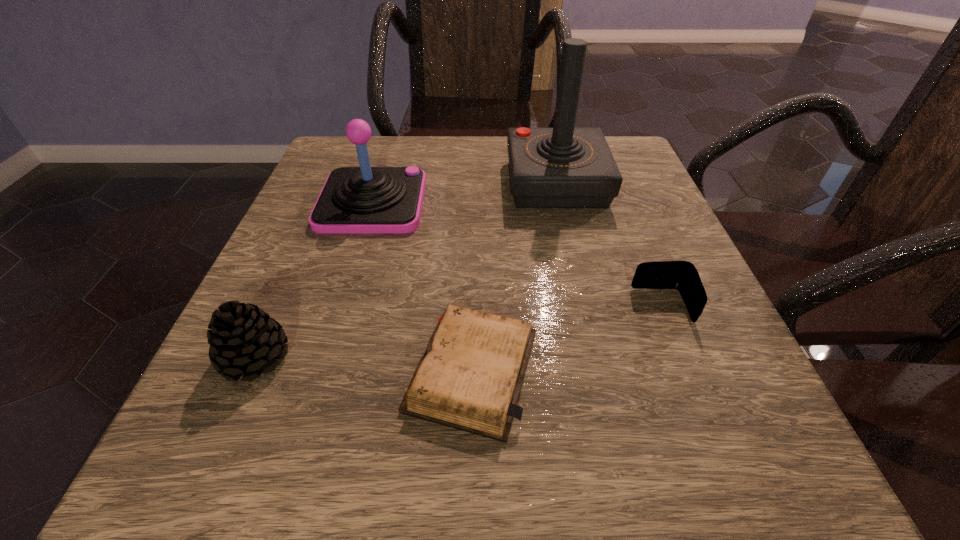
Identify the location of object that is at the far right corner. 561,167.

I want to click on vacant region at the far edge of the desktop, so click(444, 140).

Identify the location of vacant area at the left edge. (349, 306).

Where is `vacant area at the right edge of the desktop`? This screenshot has height=540, width=960. vacant area at the right edge of the desktop is located at coordinates (721, 374).

The image size is (960, 540). In the image, there is a desktop. In order to click on free space at the far right corner in this screenshot , I will do `click(632, 184)`.

In the image, there is a desktop. Find the location of `free space at the near right corner`. free space at the near right corner is located at coordinates (777, 472).

Identify the location of free spot between the third shortest object and the right joystick. The height and width of the screenshot is (540, 960). (406, 270).

You are a GUI agent. You are given a task and a screenshot of the screen. Output one action in this format:
    pyautogui.click(x=<x>, y=<y>)
    Task: Click on the free space between the shortest object and the wallet
    The height and width of the screenshot is (540, 960).
    Given the screenshot: What is the action you would take?
    pyautogui.click(x=567, y=338)

Identify the location of blank region between the taller joystick and the wallet. The image size is (960, 540). (610, 245).

At what (x,y) coordinates should I click in order to perform the action: click on unoccupied position between the left joystick and the tallest object. Please return your answer as a coordinate pair (x, y). The image size is (960, 540). Looking at the image, I should click on (465, 193).